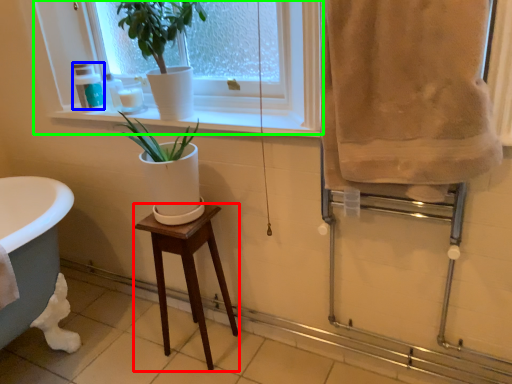
Question: Which is nearer to the stool (highlighted by a red box)? toiletry (highlighted by a blue box) or window (highlighted by a green box).

Choices:
 (A) toiletry
 (B) window

Answer: (B)